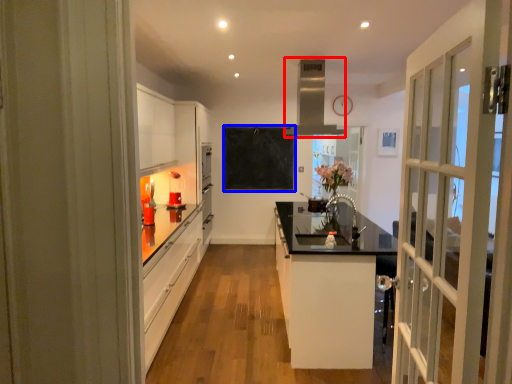
Question: Which object is further to the camera taking this photo, exhaust hood (highlighted by a red box) or bulletin board (highlighted by a blue box)?

Choices:
 (A) exhaust hood
 (B) bulletin board

Answer: (B)